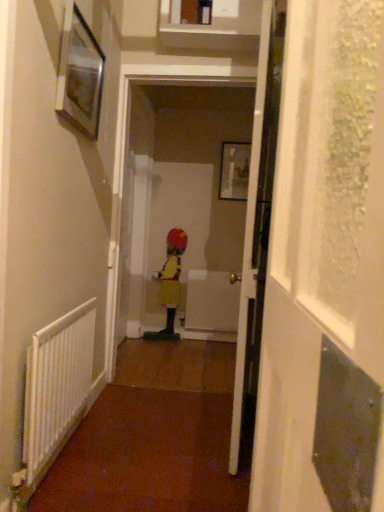
What do you see at coordinates (79, 73) in the screenshot? I see `metallic silver picture frame at upper left, which ranks as the second picture frame in right-to-left order` at bounding box center [79, 73].

What is the approximate height of metallic silver picture frame at upper left, marked as the 2th picture frame in a back-to-front arrangement?

17.94 inches.

What do you see at coordinates (234, 170) in the screenshot?
I see `matte black picture frame at upper center, which is counted as the second picture frame, starting from the front` at bounding box center [234, 170].

The width and height of the screenshot is (384, 512). Describe the element at coordinates (171, 281) in the screenshot. I see `yellow matte dress at center` at that location.

The width and height of the screenshot is (384, 512). What do you see at coordinates (325, 270) in the screenshot? I see `transparent textured screen door at right` at bounding box center [325, 270].

I want to click on white glossy door at center, so click(257, 223).

Is matte black picture frame at upper center, marked as the first picture frame in a back-to-front arrangement, far away from white plastic radiator at left?

Yes.

Is the position of matte black picture frame at upper center, marked as the first picture frame in a back-to-front arrangement, more distant than that of white plastic radiator at left?

Yes, matte black picture frame at upper center, marked as the first picture frame in a back-to-front arrangement, is further from the camera.

Based on their sizes in the image, would you say matte black picture frame at upper center, which is counted as the second picture frame, starting from the front, is bigger or smaller than white plastic radiator at left?

In the image, matte black picture frame at upper center, which is counted as the second picture frame, starting from the front, appears to be smaller than white plastic radiator at left.

Can you confirm if matte black picture frame at upper center, the second picture frame when ordered from left to right, is shorter than white plastic radiator at left?

Correct, matte black picture frame at upper center, the second picture frame when ordered from left to right, is not as tall as white plastic radiator at left.

From the image's perspective, is matte black picture frame at upper center, arranged as the first picture frame when viewed from the right, on metallic silver picture frame at upper left, which ranks as the second picture frame in right-to-left order?

No.

Is matte black picture frame at upper center, the second picture frame when ordered from left to right, not within metallic silver picture frame at upper left, which ranks as the second picture frame in right-to-left order?

Yes, matte black picture frame at upper center, the second picture frame when ordered from left to right, is located beyond the bounds of metallic silver picture frame at upper left, which ranks as the second picture frame in right-to-left order.

Considering the positions of objects matte black picture frame at upper center, marked as the first picture frame in a back-to-front arrangement, and metallic silver picture frame at upper left, which ranks as the second picture frame in right-to-left order, in the image provided, who is more to the right, matte black picture frame at upper center, marked as the first picture frame in a back-to-front arrangement, or metallic silver picture frame at upper left, which ranks as the second picture frame in right-to-left order,?

matte black picture frame at upper center, marked as the first picture frame in a back-to-front arrangement.

Can you tell me how much white glossy door at center and metallic silver picture frame at upper left, which ranks as the second picture frame in right-to-left order, differ in facing direction?

white glossy door at center and metallic silver picture frame at upper left, which ranks as the second picture frame in right-to-left order, are facing 172 degrees away from each other.

From the image's perspective, which object appears higher, white glossy door at center or metallic silver picture frame at upper left, which ranks as the second picture frame in right-to-left order?

metallic silver picture frame at upper left, which ranks as the second picture frame in right-to-left order, from the image's perspective.

Based on the photo, from a real-world perspective, which is physically above, white glossy door at center or metallic silver picture frame at upper left, which is the first picture frame from front to back?

From a 3D spatial view, metallic silver picture frame at upper left, which is the first picture frame from front to back, is above.

How distant is white glossy door at center from metallic silver picture frame at upper left, which ranks as the second picture frame in right-to-left order?

The distance of white glossy door at center from metallic silver picture frame at upper left, which ranks as the second picture frame in right-to-left order, is 92.10 centimeters.

Is point (175, 232) farther from camera compared to point (35, 395)?

Yes.

Which is more to the left, yellow matte dress at center or white plastic radiator at left?

white plastic radiator at left.

Consider the image. How much distance is there between yellow matte dress at center and white plastic radiator at left?

yellow matte dress at center is 1.94 meters away from white plastic radiator at left.

Is yellow matte dress at center behind white plastic radiator at left?

Yes.

Is white glossy door at center not within white plastic radiator at left?

Yes, white glossy door at center is located beyond the bounds of white plastic radiator at left.

Which object is closer to the camera, white glossy door at center or white plastic radiator at left?

white plastic radiator at left is more forward.

Does point (258, 220) appear closer or farther from the camera than point (31, 423)?

Clearly, point (258, 220) is more distant from the camera than point (31, 423).

Does point (89, 346) appear closer or farther from the camera than point (246, 158)?

Point (89, 346).

Looking at this image, from a real-world perspective, between white plastic radiator at left and matte black picture frame at upper center, marked as the first picture frame in a back-to-front arrangement, who is vertically higher?

matte black picture frame at upper center, marked as the first picture frame in a back-to-front arrangement.

Looking at this image, how different are the orientations of white plastic radiator at left and matte black picture frame at upper center, marked as the first picture frame in a back-to-front arrangement, in degrees?

There is a 91.4-degree angle between the facing directions of white plastic radiator at left and matte black picture frame at upper center, marked as the first picture frame in a back-to-front arrangement.

Locate an element on the screen. This screenshot has height=512, width=384. radiator in front of the matte black picture frame at upper center, which is counted as the second picture frame, starting from the front is located at coordinates (x=56, y=384).

From the image's perspective, is white plastic radiator at left over metallic silver picture frame at upper left, placed as the first picture frame when sorted from left to right?

Incorrect, from the image's perspective, white plastic radiator at left is lower than metallic silver picture frame at upper left, placed as the first picture frame when sorted from left to right.

In terms of width, does white plastic radiator at left look wider or thinner when compared to metallic silver picture frame at upper left, which is the first picture frame from front to back?

Considering their sizes, white plastic radiator at left looks broader than metallic silver picture frame at upper left, which is the first picture frame from front to back.

Choose the correct answer: Is white plastic radiator at left inside metallic silver picture frame at upper left, placed as the first picture frame when sorted from left to right, or outside it?

white plastic radiator at left cannot be found inside metallic silver picture frame at upper left, placed as the first picture frame when sorted from left to right.

Consider the image. Between white plastic radiator at left and metallic silver picture frame at upper left, which ranks as the second picture frame in right-to-left order, which one appears on the left side from the viewer's perspective?

white plastic radiator at left.

Identify the location of the 2nd picture frame behind the white plastic radiator at left, counting from the anchor's position. (234, 170).

The image size is (384, 512). Identify the location of picture frame that appears below the metallic silver picture frame at upper left, marked as the 2th picture frame in a back-to-front arrangement (from the image's perspective). (234, 170).

Based on their spatial positions, is metallic silver picture frame at upper left, placed as the first picture frame when sorted from left to right, or white glossy door at center further from matte black picture frame at upper center, arranged as the first picture frame when viewed from the right?

Among the two, metallic silver picture frame at upper left, placed as the first picture frame when sorted from left to right, is located further to matte black picture frame at upper center, arranged as the first picture frame when viewed from the right.

When comparing their distances from yellow matte dress at center, does metallic silver picture frame at upper left, which ranks as the second picture frame in right-to-left order, or transparent textured screen door at right seem further?

The object further to yellow matte dress at center is transparent textured screen door at right.

In the scene shown: Estimate the real-world distances between objects in this image. Which object is closer to metallic silver picture frame at upper left, which ranks as the second picture frame in right-to-left order, yellow matte dress at center or white plastic radiator at left?

Based on the image, white plastic radiator at left appears to be nearer to metallic silver picture frame at upper left, which ranks as the second picture frame in right-to-left order.

Based on their spatial positions, is transparent textured screen door at right or yellow matte dress at center further from matte black picture frame at upper center, the second picture frame when ordered from left to right?

transparent textured screen door at right lies further to matte black picture frame at upper center, the second picture frame when ordered from left to right, than the other object.

Based on their spatial positions, is white glossy door at center or transparent textured screen door at right closer to yellow matte dress at center?

white glossy door at center is positioned closer to the anchor yellow matte dress at center.

When comparing their distances from matte black picture frame at upper center, the second picture frame when ordered from left to right, does metallic silver picture frame at upper left, marked as the 2th picture frame in a back-to-front arrangement, or white plastic radiator at left seem closer?

metallic silver picture frame at upper left, marked as the 2th picture frame in a back-to-front arrangement, is closer to matte black picture frame at upper center, the second picture frame when ordered from left to right.

Looking at the image, which one is located further to white glossy door at center, white plastic radiator at left or yellow matte dress at center?

yellow matte dress at center lies further to white glossy door at center than the other object.

Based on their spatial positions, is yellow matte dress at center or metallic silver picture frame at upper left, which is the first picture frame from front to back, further from white glossy door at center?

yellow matte dress at center is further to white glossy door at center.

You are a GUI agent. You are given a task and a screenshot of the screen. Output one action in this format:
    pyautogui.click(x=<x>, y=<y>)
    Task: Click on the picture frame between white plastic radiator at left and yellow matte dress at center in the front-back direction
    The height and width of the screenshot is (512, 384).
    Given the screenshot: What is the action you would take?
    pyautogui.click(x=79, y=73)

What are the coordinates of `picture frame positioned between transparent textured screen door at right and yellow matte dress at center from near to far` in the screenshot? It's located at (79, 73).

Locate an element on the screen. The width and height of the screenshot is (384, 512). door between white plastic radiator at left and matte black picture frame at upper center, the second picture frame when ordered from left to right, in the front-back direction is located at coordinates (257, 223).

Where is `door between metallic silver picture frame at upper left, which is the first picture frame from front to back, and white plastic radiator at left in the up-down direction`? This screenshot has width=384, height=512. door between metallic silver picture frame at upper left, which is the first picture frame from front to back, and white plastic radiator at left in the up-down direction is located at coordinates (257, 223).